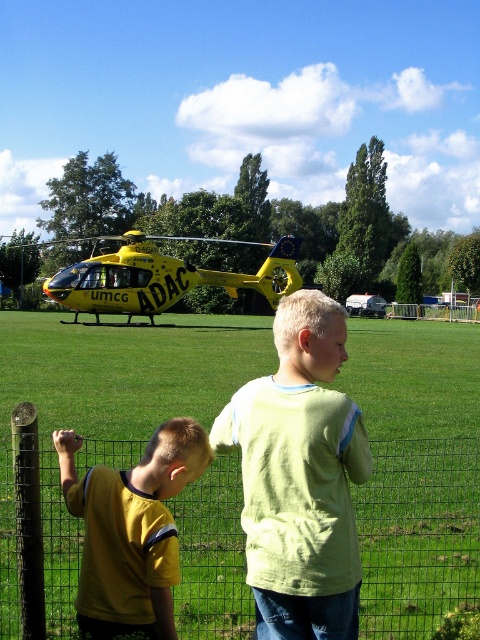
Which is behind, point (204, 436) or point (134, 307)?

The point (134, 307) is behind.

Which is above, yellow matte shirt at lower left or yellow matte helicopter at upper center?

Positioned higher is yellow matte helicopter at upper center.

The width and height of the screenshot is (480, 640). I want to click on yellow matte shirt at lower left, so click(131, 529).

Looking at this image, does wire mesh fence at lower center appear on the right side of light green cotton shirt at center?

In fact, wire mesh fence at lower center is to the left of light green cotton shirt at center.

Who is more forward, [371,502] or [288,438]?

Point [288,438] is in front.

Where is `wire mesh fence at lower center`? wire mesh fence at lower center is located at coordinates (419, 536).

Is wire mesh fence at lower center taller than yellow matte shirt at lower left?

No.

Can you confirm if wire mesh fence at lower center is smaller than yellow matte shirt at lower left?

Indeed, wire mesh fence at lower center has a smaller size compared to yellow matte shirt at lower left.

Is point (445, 504) positioned behind point (119, 545)?

Yes, it is behind point (119, 545).

Identify the location of wire mesh fence at lower center. (419, 536).